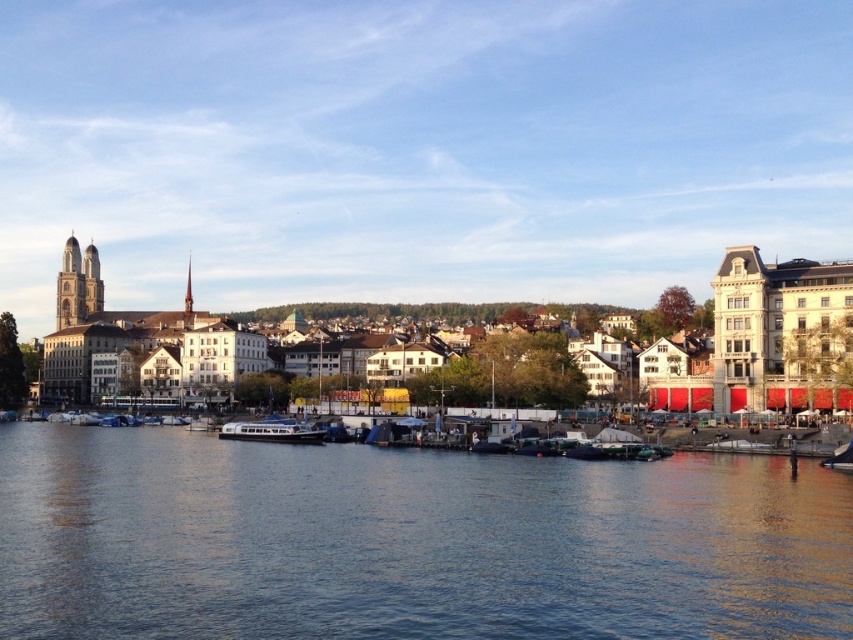
Question: Considering the relative positions of blue water at center and white matte building at left in the image provided, where is blue water at center located with respect to white matte building at left?

Choices:
 (A) left
 (B) right

Answer: (B)

Question: Is blue water at center further to the viewer compared to white matte building at left?

Choices:
 (A) yes
 (B) no

Answer: (B)

Question: Which point is closer to the camera?

Choices:
 (A) [x=306, y=435]
 (B) [x=840, y=324]

Answer: (B)

Question: Based on their relative distances, which object is nearer to the blue metallic boat at center?

Choices:
 (A) blue water at center
 (B) white matte building at left

Answer: (A)

Question: Considering the real-world distances, which object is farthest from the white matte building at left?

Choices:
 (A) blue metallic boat at center
 (B) blue water at center

Answer: (B)

Question: Can you confirm if blue water at center is positioned to the right of white matte building at left?

Choices:
 (A) yes
 (B) no

Answer: (A)